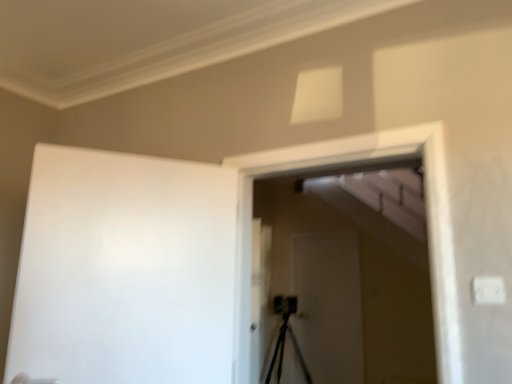
Question: Based on their positions, is white matte screen door at center, marked as the 1th screen door in a front-to-back arrangement, located to the left or right of white matte screen door at center, the second screen door viewed from the front?

Choices:
 (A) right
 (B) left

Answer: (B)

Question: Does point (381, 288) appear closer or farther from the camera than point (312, 256)?

Choices:
 (A) closer
 (B) farther

Answer: (A)

Question: Estimate the real-world distances between objects in this image. Which object is farther from the white matte screen door at center, which appears as the first screen door when viewed from the back?

Choices:
 (A) white matte screen door at center, the 2th screen door from the back
 (B) white matte barn door at left

Answer: (B)

Question: Which object is positioned closest to the white matte screen door at center, which appears as the first screen door when viewed from the back?

Choices:
 (A) white matte screen door at center, marked as the 1th screen door in a front-to-back arrangement
 (B) white matte barn door at left

Answer: (A)